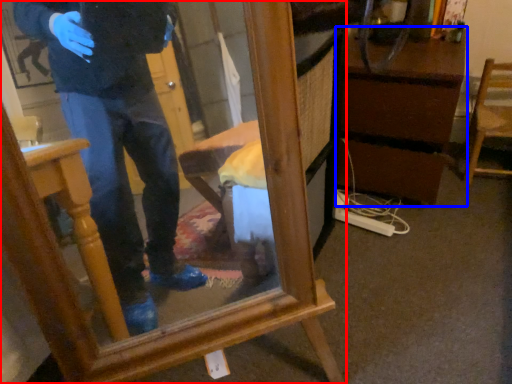
Question: Among these objects, which one is nearest to the camera, furniture (highlighted by a red box) or vanity (highlighted by a blue box)?

Choices:
 (A) furniture
 (B) vanity

Answer: (A)